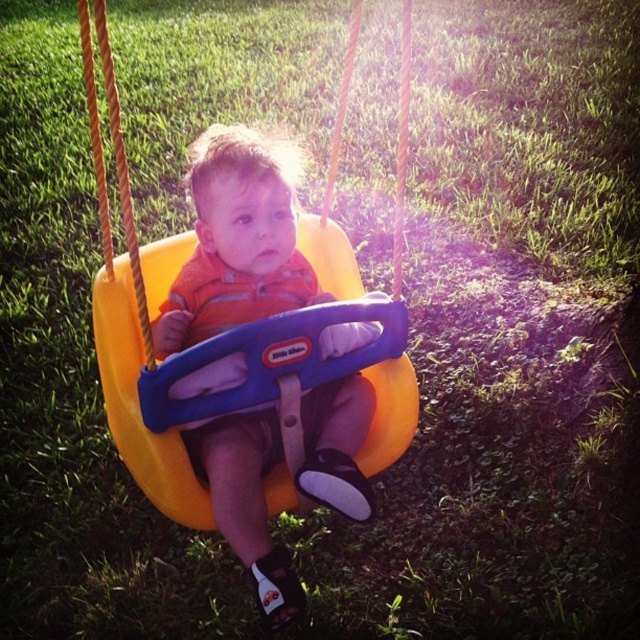
You are standing in the backyard and want to take a photo of the swing. The camera you have can only focus on objects within 5 feet. Is the point at coordinates point (296, 340) within the focus range of your camera?

The point at coordinates point (296, 340) is 5.38 feet away from the camera, which is beyond the camera focus range of 5 feet. Therefore, the camera cannot focus on it.

You are standing at the point with coordinates point (333, 460) and want to walk towards the point with coordinates point (170, 419). Will you be moving towards the direction of the child in the swing?

Yes, because point (170, 419) is in front of point (333, 460), so moving towards it would mean heading in the direction of the child in the swing.

You are a parent checking the swing set in the backyard. You see the yellow plastic swing at center and the matte orange swing at center. Which swing is positioned lower?

The yellow plastic swing at center is positioned lower than the matte orange swing at center.